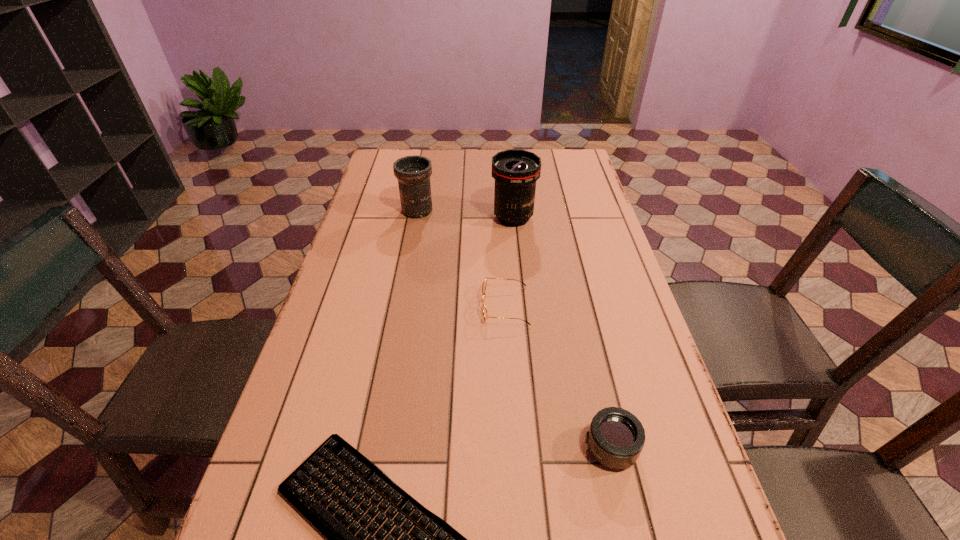
At what (x,y) coordinates should I click in order to perform the action: click on the second telephoto lens from left to right. Please return your answer as a coordinate pair (x, y). The height and width of the screenshot is (540, 960). Looking at the image, I should click on (515, 171).

Image resolution: width=960 pixels, height=540 pixels. Find the location of `the tallest telephoto lens`. the tallest telephoto lens is located at coordinates (515, 171).

Where is `the leftmost telephoto lens`? Image resolution: width=960 pixels, height=540 pixels. the leftmost telephoto lens is located at coordinates (413, 173).

The height and width of the screenshot is (540, 960). I want to click on the fourth shortest object, so click(413, 173).

I want to click on the rightmost telephoto lens, so click(616, 437).

I want to click on the rightmost object, so click(x=616, y=437).

At what (x,y) coordinates should I click in order to perform the action: click on the second shortest object. Please return your answer as a coordinate pair (x, y). This screenshot has width=960, height=540. Looking at the image, I should click on (485, 313).

Where is `the third nearest object`? The height and width of the screenshot is (540, 960). the third nearest object is located at coordinates click(x=485, y=313).

This screenshot has width=960, height=540. What are the coordinates of `blank space located 0.360m on the front of the tallest object` in the screenshot? It's located at (523, 317).

Identify the location of vacant space located 0.190m on the right of the fourth shortest object. (493, 211).